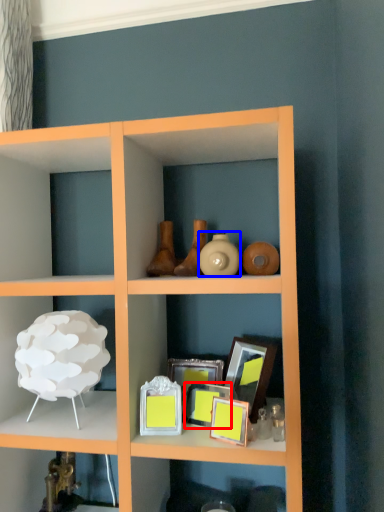
Question: Which point is closer to the camera, picture frame (highlighted by a red box) or vase (highlighted by a blue box)?

Choices:
 (A) picture frame
 (B) vase

Answer: (B)